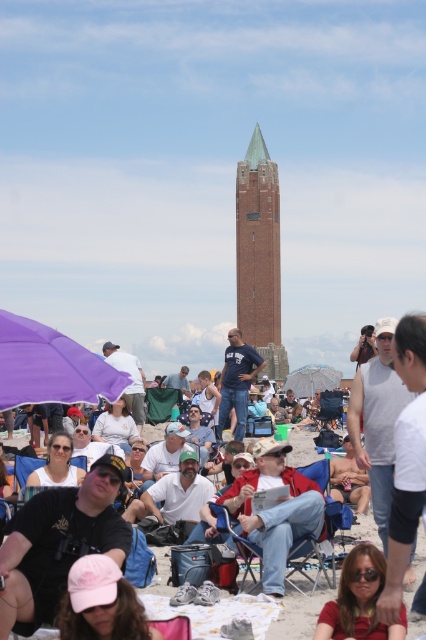
Question: Which of the following is the farthest from the observer?

Choices:
 (A) (327, 529)
 (B) (236, 182)
 (C) (301, 368)

Answer: (C)

Question: Estimate the real-world distances between objects in this image. Which object is farther from the printed fabric umbrella at center?

Choices:
 (A) purple matte umbrella at lower left
 (B) matte pink cap at lower center

Answer: (B)

Question: Among these points, which one is farthest from the camera?

Choices:
 (A) (40, 362)
 (B) (282, 538)
 (C) (351, 616)
 (D) (319, 368)

Answer: (D)

Question: Is brick tower at center in front of printed fabric umbrella at center?

Choices:
 (A) yes
 (B) no

Answer: (A)

Question: Observing the image, what is the correct spatial positioning of blue fabric chair at center in reference to matte pink cap at lower center?

Choices:
 (A) left
 (B) right

Answer: (A)

Question: Is blue fabric chair at center positioned in front of printed fabric umbrella at center?

Choices:
 (A) yes
 (B) no

Answer: (A)